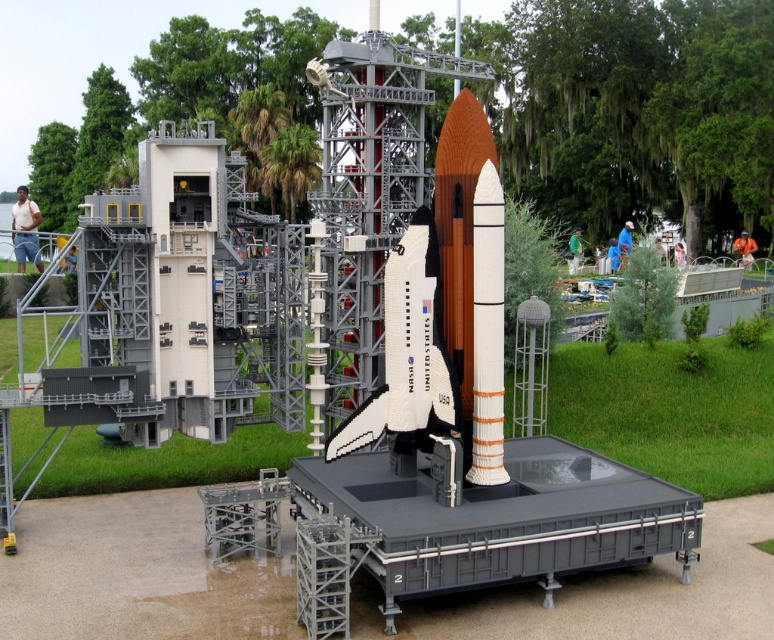
You are an astronaut preparing for a space mission and you see the brick orange rocket at center and the metallic gray lift at center. Which object is closer to you?

The brick orange rocket at center is closer to you because it is in front of the metallic gray lift at center.

You are standing in front of the LEGO space shuttle launch model. You want to place a small LEGO figure between the white plastic rocket at center and the metallic gray lift at center. Which object should you place the figure closer to if you want it to be nearer to the front of the model?

You should place the LEGO figure closer to the white plastic rocket at center because it is positioned closer to the viewer than the metallic gray lift at center, making it the frontmost object.

You are an engineer inspecting the LEGO space shuttle model. You need to determine which object is taller between the brick orange rocket at center and the metallic gray lift at center. Which one is taller?

The brick orange rocket at center is taller than the metallic gray lift at center according to the description.